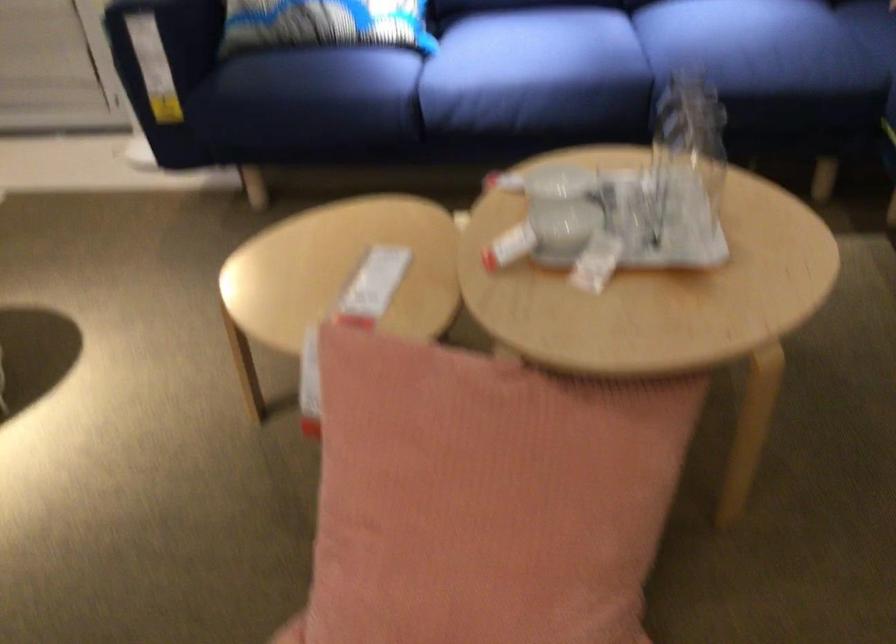
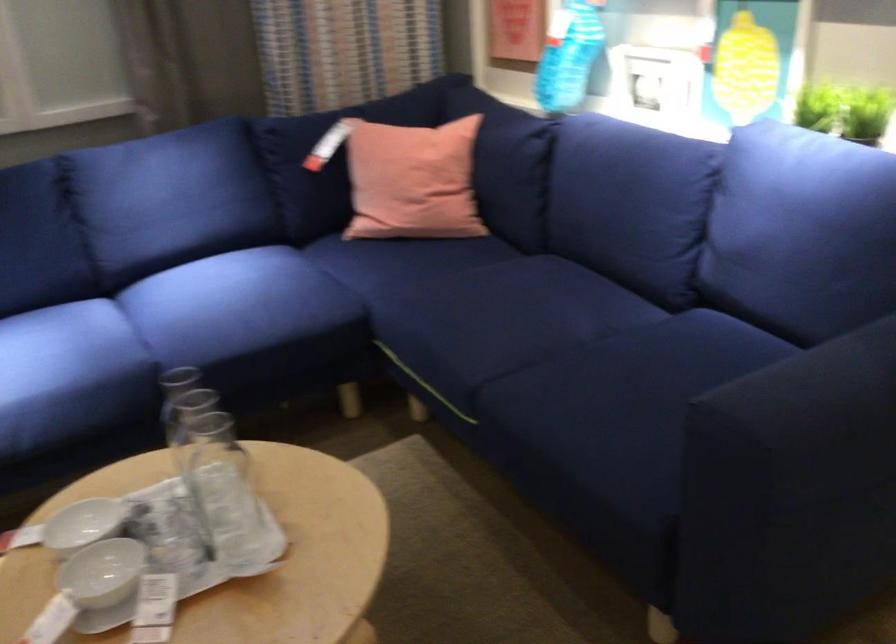
Question: The images are taken continuously from a first-person perspective. In which direction is your viewpoint rotating?

Choices:
 (A) Left
 (B) Right
 (C) Up
 (D) Down

Answer: (B)